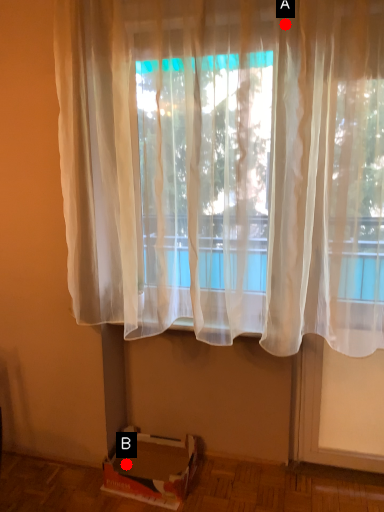
Question: Two points are circled on the image, labeled by A and B beside each circle. Among these points, which one is farthest from the camera?

Choices:
 (A) A is further
 (B) B is further

Answer: (B)